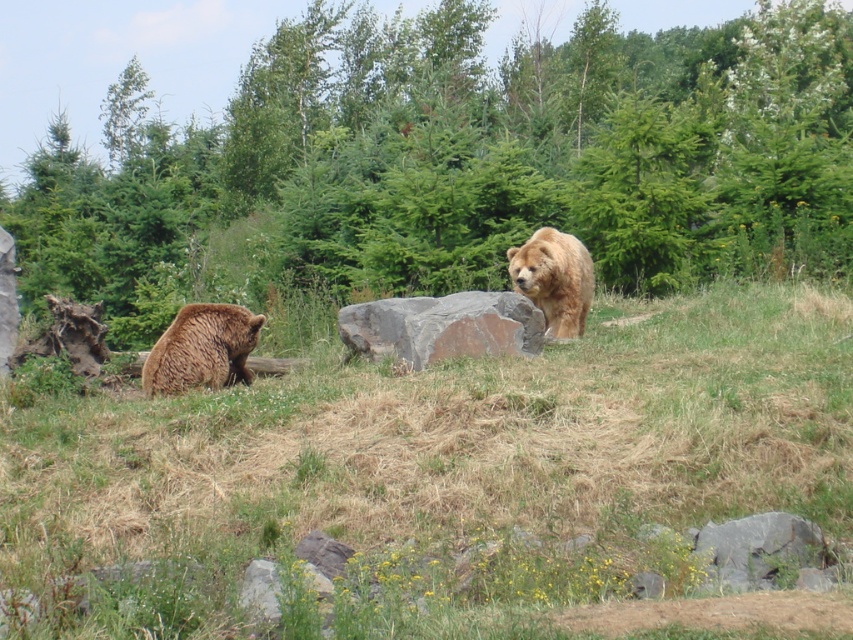
You are a photographer aiming to capture both the green leafy tree at center and the golden fur bear at center in a single frame. Based on their positions, which object should you adjust your camera angle to focus on first to ensure both are in the shot?

Since the green leafy tree at center is to the right of the golden fur bear at center, you should first focus on the golden fur bear at center to ensure the tree remains within the frame.